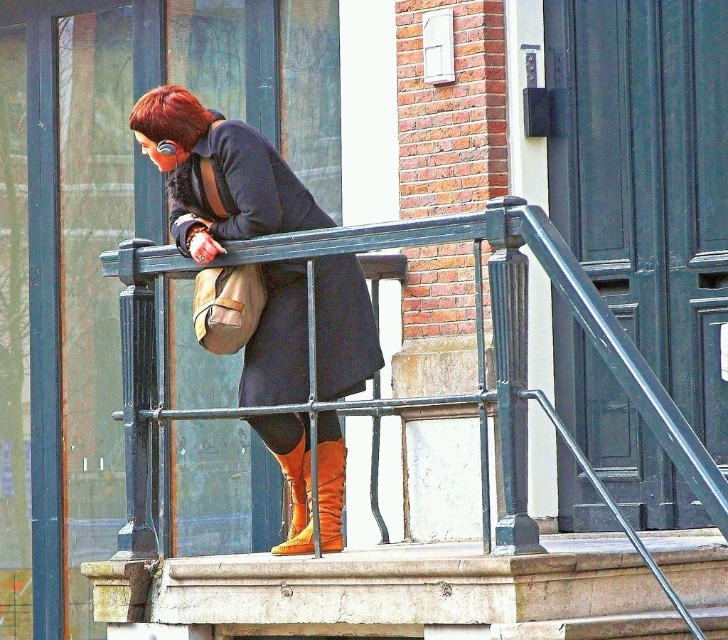
In the scene, there is a person on a balcony wearing a matte black coat at center and orange suede boot at lower center. From the perspective of someone standing on the balcony, which object is positioned to the left?

The matte black coat at center is to the left of the orange suede boot at lower center.

You are a photographer trying to capture the person on the balcony. The person is standing at point (170, 116) which marks shiny brown hair at upper left. Where should you position your camera to get a clear view of their face?

The point (170, 116) marks the shiny brown hair at upper left, so positioning the camera slightly to the right and below this point would allow a clear view of the person face.

You are a painter trying to place a 1.2 meter wide canvas on the balcony. The canvas must be placed between the black metal balustrade at center and the shiny brown hair at upper left. Can the canvas fit there?

The black metal balustrade at center is wider than the shiny brown hair at upper left. However, without knowing the exact width of the space between them, it is impossible to determine if the 1.2 meter wide canvas will fit.